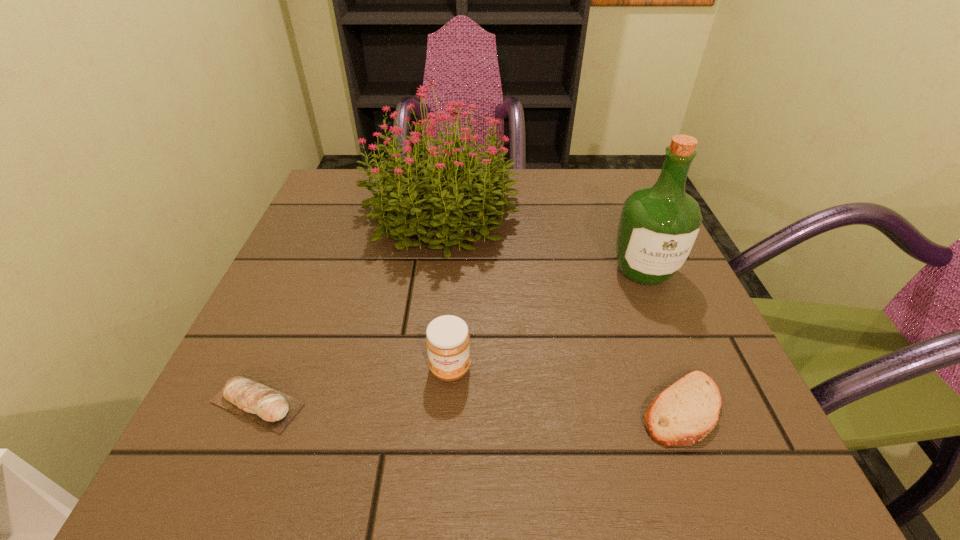
You are a GUI agent. You are given a task and a screenshot of the screen. Output one action in this format:
    pyautogui.click(x=<x>, y=<y>)
    Task: Click on the bouquet
    Image resolution: width=960 pixels, height=540 pixels.
    Given the screenshot: What is the action you would take?
    tap(465, 188)

Identify the location of liquor. (658, 226).

In order to click on jam in this screenshot , I will do `click(447, 338)`.

Image resolution: width=960 pixels, height=540 pixels. I want to click on the left pita bread, so click(270, 408).

This screenshot has width=960, height=540. I want to click on the second shortest object, so click(270, 408).

At what (x,y) coordinates should I click in order to perform the action: click on the right pita bread. Please return your answer as a coordinate pair (x, y). The height and width of the screenshot is (540, 960). Looking at the image, I should click on (683, 414).

You are a GUI agent. You are given a task and a screenshot of the screen. Output one action in this format:
    pyautogui.click(x=<x>, y=<y>)
    Task: Click on the shorter pita bread
    
    Given the screenshot: What is the action you would take?
    pyautogui.click(x=683, y=414)

Find the location of a particular element. This screenshot has width=960, height=540. free space located on the front of the bouquet is located at coordinates (420, 388).

Where is `vacant space located 0.240m on the front-facing side of the liquor`? vacant space located 0.240m on the front-facing side of the liquor is located at coordinates (701, 408).

This screenshot has height=540, width=960. What are the coordinates of `blank space located 0.110m on the front label of the jam` in the screenshot? It's located at (444, 456).